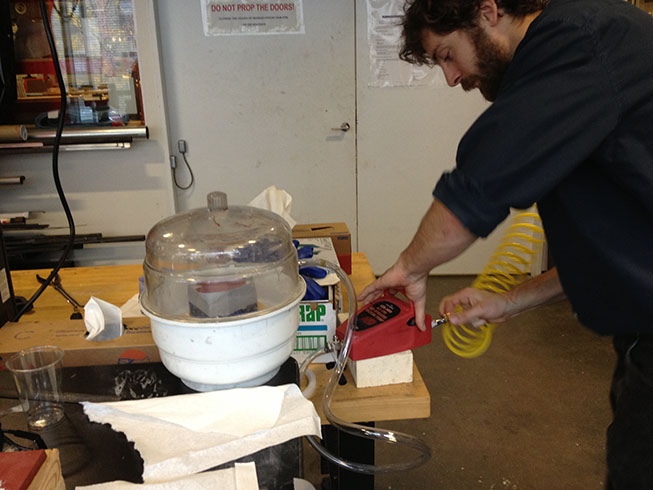
Locate an element on the screen. This screenshot has width=653, height=490. floor is located at coordinates (597, 394).